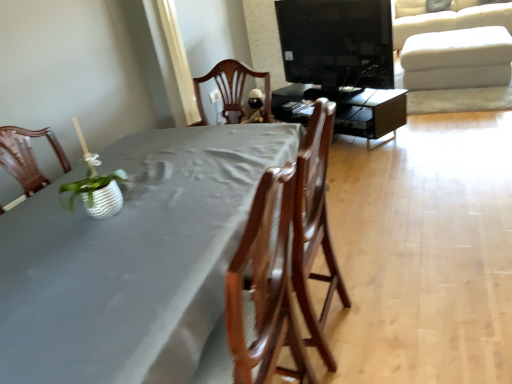
Question: Relative to matte black tv stand at center, marked as the 2th table in a left-to-right arrangement, is black glossy tv at upper center in front or behind?

Choices:
 (A) front
 (B) behind

Answer: (A)

Question: Looking at their shapes, would you say black glossy tv at upper center is wider or thinner than matte black tv stand at center, positioned as the 1th table in right-to-left order?

Choices:
 (A) thin
 (B) wide

Answer: (A)

Question: Considering the real-world distances, which object is farthest from the gray fabric table at center, the first table positioned from the left?

Choices:
 (A) wooden chair at center
 (B) black glossy tv at upper center
 (C) white fabric ottoman at upper right
 (D) matte black tv stand at center, positioned as the 1th table in right-to-left order
 (E) white textured pot at left

Answer: (C)

Question: Which is nearer to the gray fabric table at center, which is the 1th table in front-to-back order?

Choices:
 (A) wooden chair at center
 (B) matte black tv stand at center, the 2th table from the front
 (C) white textured pot at left
 (D) black glossy tv at upper center
 (E) white fabric ottoman at upper right

Answer: (C)